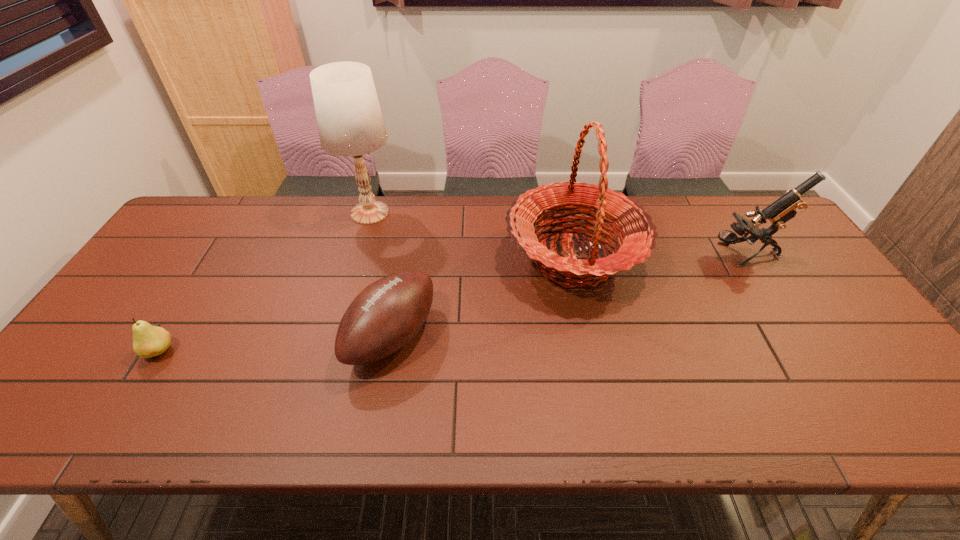
In the image, there is a desktop. In order to click on vacant area at the far left corner in this screenshot , I will do `click(215, 233)`.

Where is `free region at the near left corner of the desktop`? This screenshot has width=960, height=540. free region at the near left corner of the desktop is located at coordinates (71, 400).

Identify the location of vacant region at the far right corner of the desktop. Image resolution: width=960 pixels, height=540 pixels. (750, 207).

Where is `vacant space that is in between the leftmost object and the fourth tallest object`? vacant space that is in between the leftmost object and the fourth tallest object is located at coordinates (276, 344).

In order to click on free space between the microscope and the lamp in this screenshot , I will do click(x=557, y=234).

Where is `free space between the fourth tallest object and the lamp`? The height and width of the screenshot is (540, 960). free space between the fourth tallest object and the lamp is located at coordinates (381, 275).

At what (x,y) coordinates should I click in order to perform the action: click on vacant space that's between the microscope and the leftmost object. Please return your answer as a coordinate pair (x, y). The width and height of the screenshot is (960, 540). Looking at the image, I should click on (452, 303).

Locate an element on the screen. Image resolution: width=960 pixels, height=540 pixels. free space between the rightmost object and the basket is located at coordinates (659, 257).

Find the location of a particular element. free spot between the lamp and the football (American) is located at coordinates (381, 275).

Where is `blank region between the rightmost object and the lamp`? The height and width of the screenshot is (540, 960). blank region between the rightmost object and the lamp is located at coordinates (557, 234).